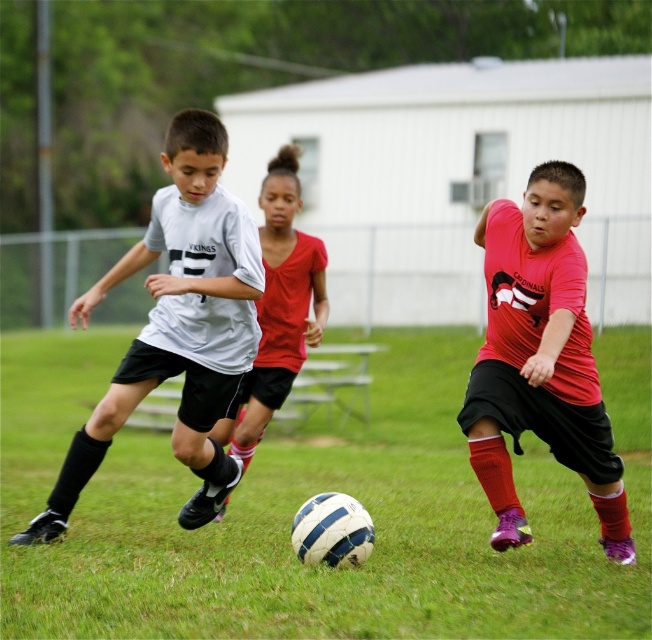
Which is in front, point (422, 406) or point (288, 305)?

Point (288, 305)

Is white textured soccer ball at center bigger than matte red shirt at center?

Yes.

The image size is (652, 640). Describe the element at coordinates (301, 502) in the screenshot. I see `white textured soccer ball at center` at that location.

Identify the location of white textured soccer ball at center. (301, 502).

Is white matte jersey at center further to camera compared to matte red shirt at center?

No, white matte jersey at center is in front of matte red shirt at center.

Which is more to the left, white matte jersey at center or matte red shirt at center?

From the viewer's perspective, white matte jersey at center appears more on the left side.

Is point (228, 307) behind point (274, 188)?

No, (228, 307) is in front of (274, 188).

Find the location of a particular element. The width and height of the screenshot is (652, 640). white matte jersey at center is located at coordinates (177, 324).

In the scene shown: Can you confirm if matte red jersey at center is wider than matte red shirt at center?

Yes.

Consider the image. Measure the distance between matte red jersey at center and camera.

matte red jersey at center and camera are 5.26 meters apart.

The image size is (652, 640). In order to click on matte red jersey at center in this screenshot , I will do `click(541, 358)`.